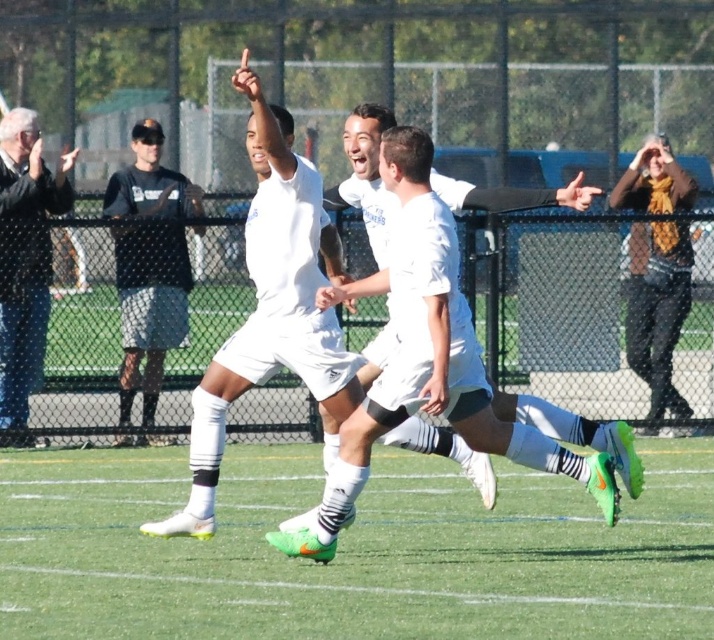
You are a photographer trying to capture a photo of the blue jeans at left and the brown leather jacket at upper right in the scene. Which one is located to the left of the other?

The blue jeans at left is positioned on the left side of brown leather jacket at upper right.

You are a photographer standing at the center of the soccer field. You want to capture a photo of the blue jeans at left. In which direction should you move to get the best shot?

The blue jeans at left is located at point 0.412 on the x axis and 0.035 on the y axis. Since you are at the center, you should move to the left to align with the x coordinate and slightly downward to align with the y coordinate for the best shot.